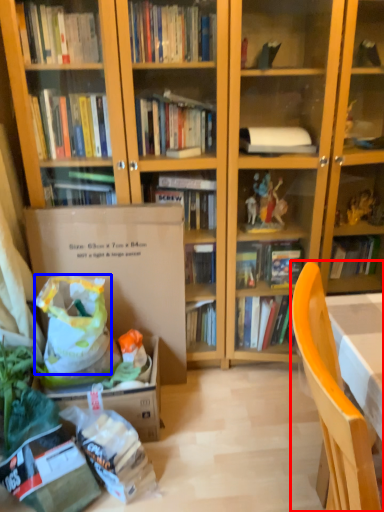
Question: Which object is further to the camera taking this photo, chair (highlighted by a red box) or grocery bag (highlighted by a blue box)?

Choices:
 (A) chair
 (B) grocery bag

Answer: (B)